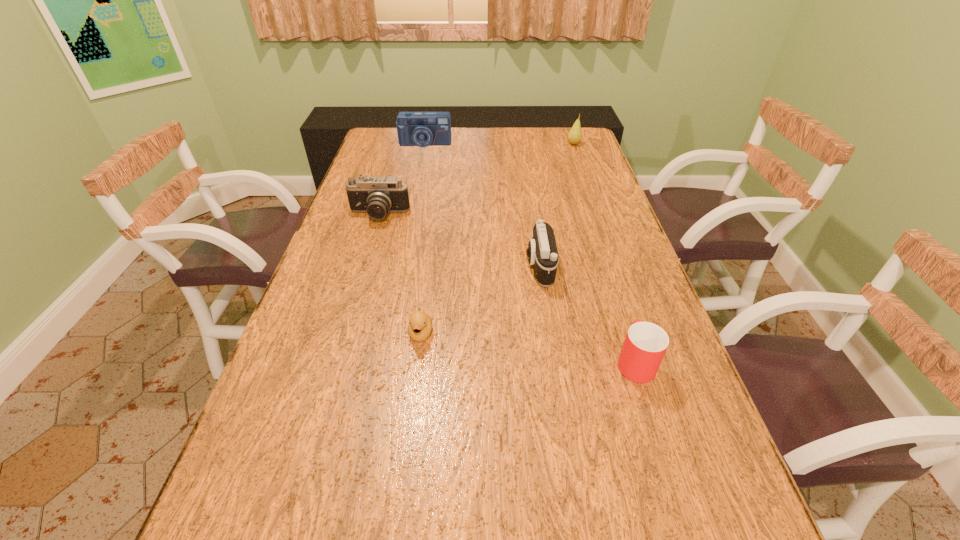
Identify the location of free space that is in between the pear and the cup. The image size is (960, 540). (604, 253).

The image size is (960, 540). I want to click on free space between the pear and the second nearest camera, so click(x=476, y=180).

The image size is (960, 540). I want to click on vacant region between the third farthest object and the third nearest object, so click(x=459, y=241).

Locate an element on the screen. The image size is (960, 540). empty location between the cup and the duckling is located at coordinates (528, 347).

Select which object appears as the closest to the third farthest object. Please provide its 2D coordinates. Your answer should be formatted as a tuple, i.e. [(x, y)], where the tuple contains the x and y coordinates of a point satisfying the conditions above.

[(542, 253)]

Choose which object is the third nearest neighbor to the farthest camera. Please provide its 2D coordinates. Your answer should be formatted as a tuple, i.e. [(x, y)], where the tuple contains the x and y coordinates of a point satisfying the conditions above.

[(542, 253)]

Select which camera appears as the closest to the farthest camera. Please provide its 2D coordinates. Your answer should be formatted as a tuple, i.e. [(x, y)], where the tuple contains the x and y coordinates of a point satisfying the conditions above.

[(376, 195)]

Where is `camera that is the closest to the second nearest camera`? The image size is (960, 540). camera that is the closest to the second nearest camera is located at coordinates (542, 253).

This screenshot has width=960, height=540. I want to click on free spot that satisfies the following two spatial constraints: 1. on the front lens of the nearest camera; 2. on the side of the cup with the handle, so click(554, 362).

Image resolution: width=960 pixels, height=540 pixels. In order to click on blank area in the image that satisfies the following two spatial constraints: 1. on the side of the cup with the handle; 2. on the right side of the pear in this screenshot , I will do `click(565, 144)`.